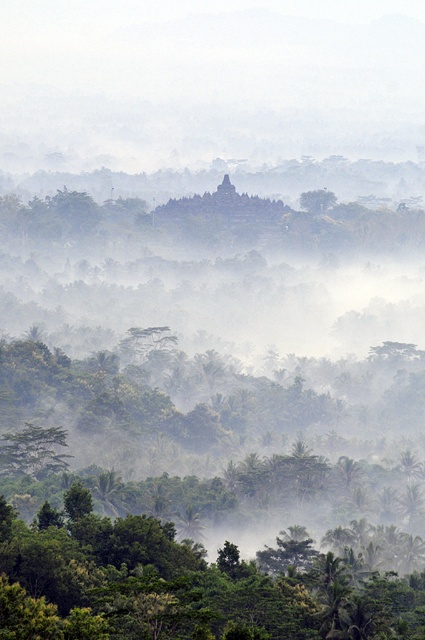
Which is in front, point (303, 536) or point (47, 448)?

Point (303, 536) is in front.

What are the coordinates of `green leafy tree at lower center` in the screenshot? It's located at (186, 582).